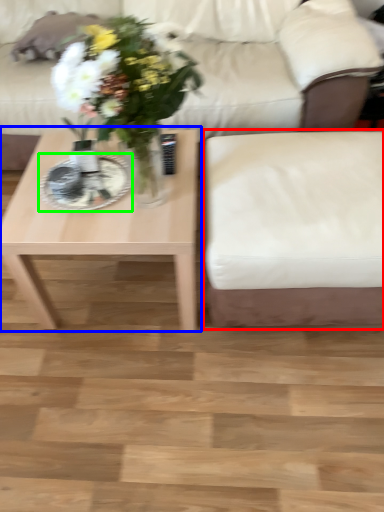
Question: Which object is the farthest from armchair (highlighted by a red box)? Choose among these: coffee table (highlighted by a blue box) or plate (highlighted by a green box).

Choices:
 (A) coffee table
 (B) plate

Answer: (B)